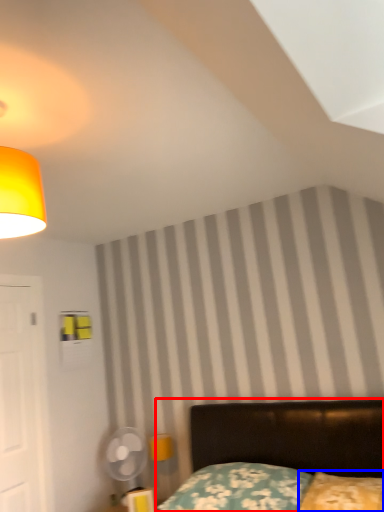
Question: Which of the following is the closest to the observer, bed (highlighted by a red box) or pillow (highlighted by a blue box)?

Choices:
 (A) bed
 (B) pillow

Answer: (A)